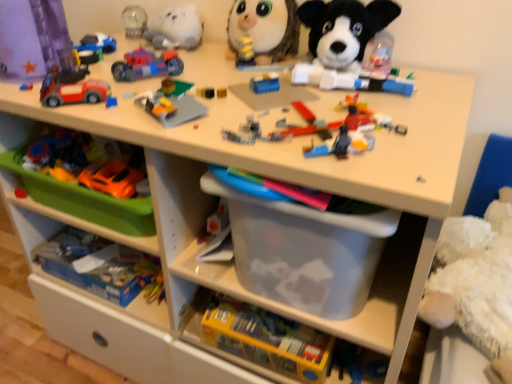
At what (x,y) coordinates should I click in order to perform the action: click on free space in front of yellow striped plush at upper center, marked as the first toy in a top-to-bottom arrangement. Please return your answer as a coordinate pair (x, y). The width and height of the screenshot is (512, 384). Looking at the image, I should click on (250, 81).